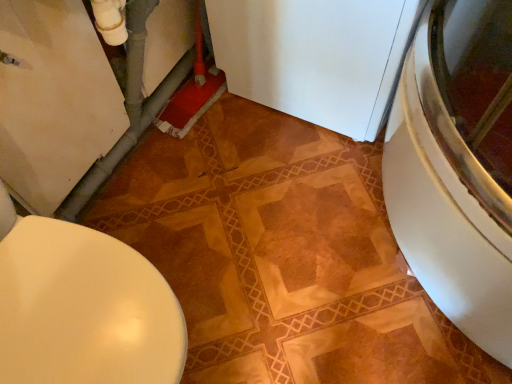
The width and height of the screenshot is (512, 384). Find the location of `white matte refrigerator at center`. white matte refrigerator at center is located at coordinates (316, 56).

What do you see at coordinates (316, 56) in the screenshot? The image size is (512, 384). I see `white matte refrigerator at center` at bounding box center [316, 56].

Measure the distance between white matte refrigerator at center and camera.

A: They are 38.38 inches apart.

In order to face white matte refrigerator at center, should I rotate leftwards or rightwards?

To face it directly, rotate right by 9.279 degrees.

Measure the distance between point (283, 96) and camera.

Point (283, 96) and camera are 1.45 meters apart.

The height and width of the screenshot is (384, 512). Describe the element at coordinates (84, 309) in the screenshot. I see `matte white toilet at lower left` at that location.

At what (x,y) coordinates should I click in order to perform the action: click on matte white toilet at lower left. Please return your answer as a coordinate pair (x, y). The image size is (512, 384). Looking at the image, I should click on (84, 309).

This screenshot has width=512, height=384. I want to click on white matte refrigerator at center, so click(x=316, y=56).

Considering the relative positions of matte white toilet at lower left and white matte refrigerator at center in the image provided, is matte white toilet at lower left to the left of white matte refrigerator at center from the viewer's perspective?

Indeed, matte white toilet at lower left is positioned on the left side of white matte refrigerator at center.

Is matte white toilet at lower left in front of white matte refrigerator at center?

Yes, matte white toilet at lower left is closer to the camera.

Between point (34, 375) and point (314, 12), which one is positioned behind?

The point (314, 12) is farther from the camera.

From the image's perspective, is matte white toilet at lower left located beneath white matte refrigerator at center?

Yes.

From a real-world perspective, is matte white toilet at lower left physically below white matte refrigerator at center?

No.

Is matte white toilet at lower left thinner than white matte refrigerator at center?

Yes, matte white toilet at lower left is thinner than white matte refrigerator at center.

In terms of height, does matte white toilet at lower left look taller or shorter compared to white matte refrigerator at center?

Considering their sizes, matte white toilet at lower left has less height than white matte refrigerator at center.

Does matte white toilet at lower left have a larger size compared to white matte refrigerator at center?

No.

Can we say matte white toilet at lower left lies outside white matte refrigerator at center?

Absolutely, matte white toilet at lower left is external to white matte refrigerator at center.

Based on the photo, would you say matte white toilet at lower left is a long distance from white matte refrigerator at center?

That's not correct — matte white toilet at lower left is a little close to white matte refrigerator at center.

Is matte white toilet at lower left positioned with its back to white matte refrigerator at center?

No, matte white toilet at lower left's orientation is not away from white matte refrigerator at center.

How far apart are matte white toilet at lower left and white matte refrigerator at center?

matte white toilet at lower left is 33.13 inches away from white matte refrigerator at center.

Identify the location of toilet on the left of the white matte refrigerator at center. The image size is (512, 384). (84, 309).

Which is more to the left, white matte refrigerator at center or matte white toilet at lower left?

Positioned to the left is matte white toilet at lower left.

Which object is closer to the camera taking this photo, white matte refrigerator at center or matte white toilet at lower left?

Positioned in front is matte white toilet at lower left.

Considering the points (323, 13) and (42, 379), which point is behind, point (323, 13) or point (42, 379)?

The point (323, 13) is more distant.

From the image's perspective, which is below, white matte refrigerator at center or matte white toilet at lower left?

matte white toilet at lower left is shown below in the image.

From a real-world perspective, is white matte refrigerator at center beneath matte white toilet at lower left?

Yes, from a real-world perspective, white matte refrigerator at center is below matte white toilet at lower left.

Considering the relative sizes of white matte refrigerator at center and matte white toilet at lower left in the image provided, is white matte refrigerator at center thinner than matte white toilet at lower left?

In fact, white matte refrigerator at center might be wider than matte white toilet at lower left.

Does white matte refrigerator at center have a greater height compared to matte white toilet at lower left?

Yes, white matte refrigerator at center is taller than matte white toilet at lower left.

Which of these two, white matte refrigerator at center or matte white toilet at lower left, is bigger?

Bigger between the two is white matte refrigerator at center.

Is white matte refrigerator at center outside of matte white toilet at lower left?

Yes, white matte refrigerator at center is not within matte white toilet at lower left.

Is white matte refrigerator at center in contact with matte white toilet at lower left?

There is a gap between white matte refrigerator at center and matte white toilet at lower left.

Is white matte refrigerator at center oriented away from matte white toilet at lower left?

No, white matte refrigerator at center's orientation is not away from matte white toilet at lower left.

Locate an element on the screen. The width and height of the screenshot is (512, 384). appliance that appears below the matte white toilet at lower left (from a real-world perspective) is located at coordinates (316, 56).

You are a GUI agent. You are given a task and a screenshot of the screen. Output one action in this format:
    pyautogui.click(x=<x>, y=<y>)
    Task: Click on the appliance located underneath the matte white toilet at lower left (from a real-world perspective)
    
    Given the screenshot: What is the action you would take?
    pyautogui.click(x=316, y=56)

At what (x,y) coordinates should I click in order to perform the action: click on toilet on the left of white matte refrigerator at center. Please return your answer as a coordinate pair (x, y). Looking at the image, I should click on (84, 309).